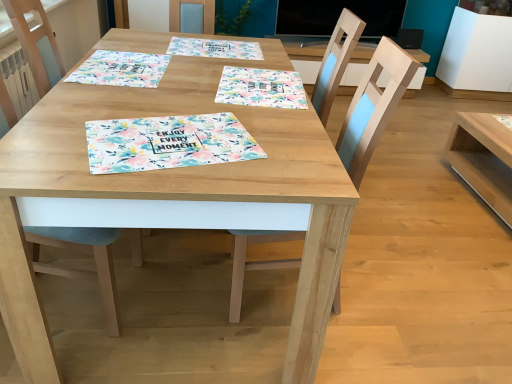
This screenshot has height=384, width=512. In order to click on free space to the left of floral paper placemat at upper center, marked as the second tablecloth in a right-to-left arrangement in this screenshot , I will do `click(139, 43)`.